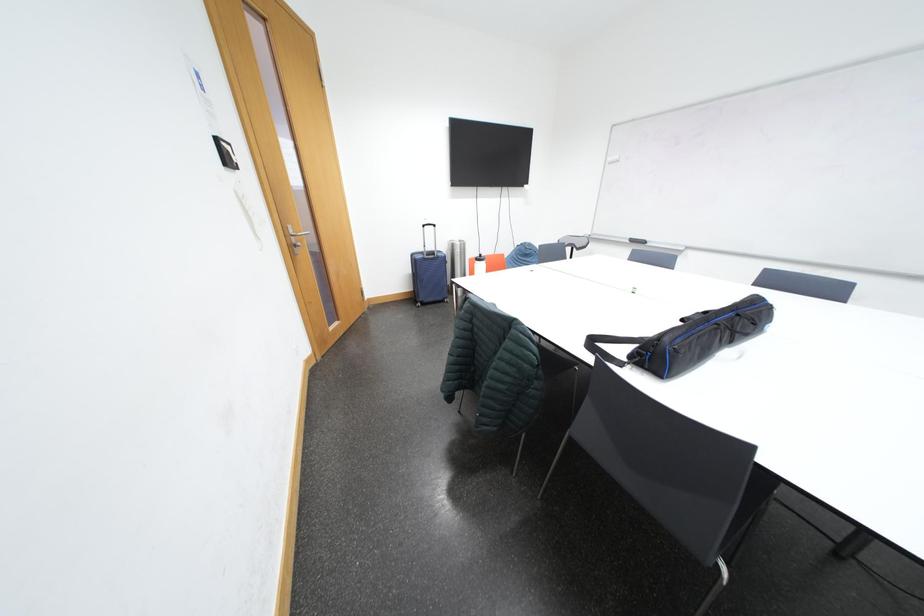
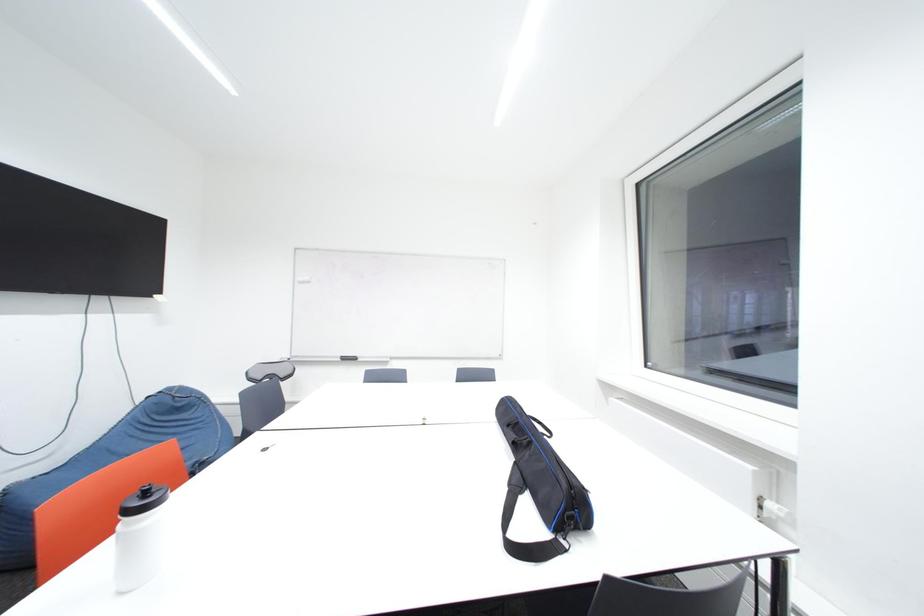
Question: The first image is from the beginning of the video and the second image is from the end. How did the camera likely rotate when shooting the video?

Choices:
 (A) Left
 (B) Right
 (C) Up
 (D) Down

Answer: (B)